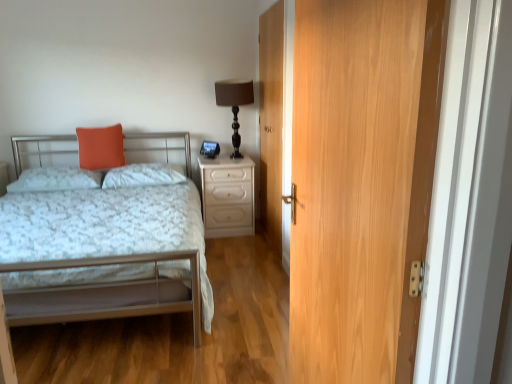
Where is `space that is in front of wooden door at center, which appears as the first door when viewed from the back`? space that is in front of wooden door at center, which appears as the first door when viewed from the back is located at coordinates (248, 264).